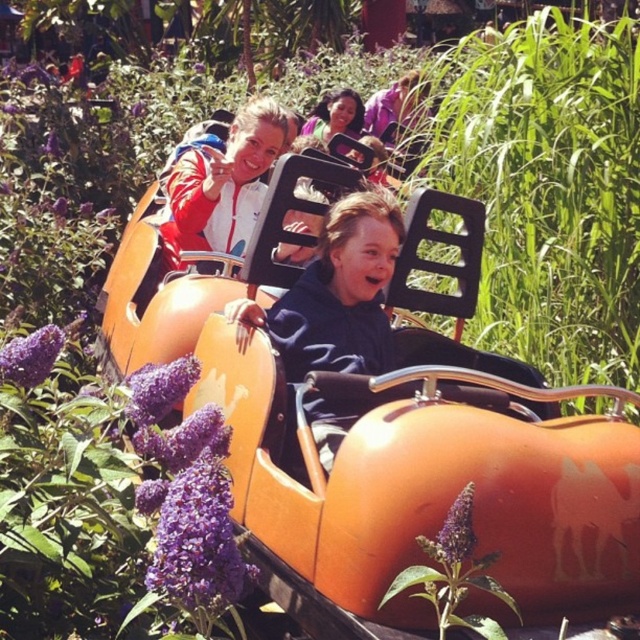
Question: In this image, where is matte red jacket at upper center located relative to smooth skin girl at center?

Choices:
 (A) left
 (B) right

Answer: (A)

Question: Is matte red jacket at upper center wider than smooth skin girl at center?

Choices:
 (A) no
 (B) yes

Answer: (B)

Question: In this image, where is matte red jacket at upper center located relative to smooth skin girl at center?

Choices:
 (A) above
 (B) below

Answer: (B)